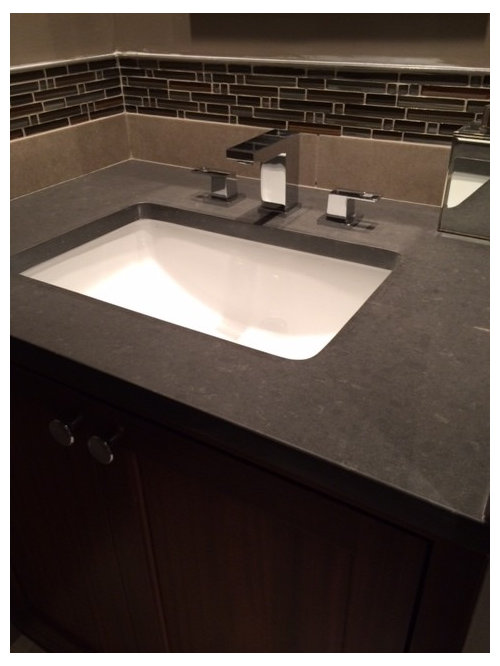
Locate an element on the screen. This screenshot has height=666, width=500. place where water comes out into the sink is located at coordinates (244, 163).